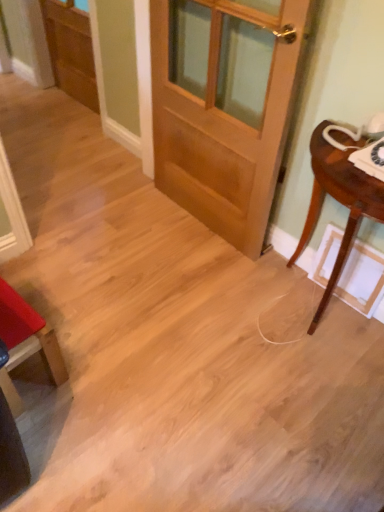
What do you see at coordinates (224, 108) in the screenshot?
I see `light brown wood door at center` at bounding box center [224, 108].

What do you see at coordinates (338, 201) in the screenshot?
I see `mahogany wood table at right` at bounding box center [338, 201].

Locate an element on the screen. light brown wood door at center is located at coordinates click(224, 108).

Locate an element on the screen. This screenshot has height=512, width=384. screen door located above the matte red chair at lower left (from a real-world perspective) is located at coordinates (71, 50).

Is matte red chair at lower left far from wooden screen door at upper left?

Yes, matte red chair at lower left and wooden screen door at upper left are located far from each other.

Which is closer to the camera, (x=22, y=307) or (x=61, y=46)?

Point (x=22, y=307) is positioned closer to the camera compared to point (x=61, y=46).

Which is correct: matte red chair at lower left is inside wooden screen door at upper left, or outside of it?

matte red chair at lower left exists outside the volume of wooden screen door at upper left.

Are mahogany wood table at right and light brown wood door at center far apart?

No, there isn't a large distance between mahogany wood table at right and light brown wood door at center.

From the image's perspective, is mahogany wood table at right located above light brown wood door at center?

No.

Is mahogany wood table at right smaller than light brown wood door at center?

Incorrect, mahogany wood table at right is not smaller in size than light brown wood door at center.

In the image, is mahogany wood table at right on the left side or the right side of light brown wood door at center?

In the image, mahogany wood table at right appears on the right side of light brown wood door at center.

Can you confirm if light brown wood door at center is positioned to the left of mahogany wood table at right?

Correct, you'll find light brown wood door at center to the left of mahogany wood table at right.

From a real-world perspective, does light brown wood door at center sit lower than mahogany wood table at right?

Actually, light brown wood door at center is physically above mahogany wood table at right in the real world.

Is light brown wood door at center wider than mahogany wood table at right?

No, light brown wood door at center is not wider than mahogany wood table at right.

Does light brown wood door at center turn towards mahogany wood table at right?

No, light brown wood door at center does not turn towards mahogany wood table at right.

Is matte red chair at lower left positioned before mahogany wood table at right?

That is False.

Which of these two, matte red chair at lower left or mahogany wood table at right, is thinner?

Thinner between the two is mahogany wood table at right.

Between point (26, 315) and point (348, 238), which one is positioned in front?

The point (26, 315) is in front.

Locate an element on the screen. The width and height of the screenshot is (384, 512). chair below the mahogany wood table at right (from a real-world perspective) is located at coordinates (26, 343).

Does point (54, 378) appear closer or farther from the camera than point (166, 73)?

Point (54, 378) is positioned closer to the camera compared to point (166, 73).

Considering the sizes of objects matte red chair at lower left and light brown wood door at center in the image provided, who is bigger, matte red chair at lower left or light brown wood door at center?

Bigger between the two is light brown wood door at center.

Identify the location of chair to the left of light brown wood door at center. (26, 343).

From their relative heights in the image, would you say light brown wood door at center is taller or shorter than matte red chair at lower left?

Clearly, light brown wood door at center is taller compared to matte red chair at lower left.

Is light brown wood door at center placed right next to matte red chair at lower left?

No, light brown wood door at center is not touching matte red chair at lower left.

From the image's perspective, does light brown wood door at center appear higher than matte red chair at lower left?

Yes.

Is point (84, 63) positioned before point (206, 42)?

No, (84, 63) is further to viewer.

From their relative heights in the image, would you say wooden screen door at upper left is taller or shorter than light brown wood door at center?

wooden screen door at upper left is shorter than light brown wood door at center.

Consider the image. Between wooden screen door at upper left and light brown wood door at center, which one has larger size?

light brown wood door at center.

What are the coordinates of `screen door that is under the light brown wood door at center (from a real-world perspective)` in the screenshot? It's located at (71, 50).

You are a GUI agent. You are given a task and a screenshot of the screen. Output one action in this format:
    pyautogui.click(x=<x>, y=<y>)
    Task: Click on the chair lying in front of the wooden screen door at upper left
    The width and height of the screenshot is (384, 512).
    Given the screenshot: What is the action you would take?
    (26, 343)

Where is `table directly beneath the light brown wood door at center (from a real-world perspective)`? The height and width of the screenshot is (512, 384). table directly beneath the light brown wood door at center (from a real-world perspective) is located at coordinates (338, 201).

Based on their spatial positions, is light brown wood door at center or mahogany wood table at right further from matte red chair at lower left?

Among the two, light brown wood door at center is located further to matte red chair at lower left.

When comparing their distances from mahogany wood table at right, does light brown wood door at center or wooden screen door at upper left seem further?

Based on the image, wooden screen door at upper left appears to be further to mahogany wood table at right.

When comparing their distances from wooden screen door at upper left, does light brown wood door at center or matte red chair at lower left seem further?

The object further to wooden screen door at upper left is matte red chair at lower left.

When comparing their distances from wooden screen door at upper left, does mahogany wood table at right or light brown wood door at center seem further?

Among the two, mahogany wood table at right is located further to wooden screen door at upper left.

Which object lies further to the anchor point light brown wood door at center, matte red chair at lower left or wooden screen door at upper left?

The object further to light brown wood door at center is wooden screen door at upper left.

In the scene shown: Based on their spatial positions, is mahogany wood table at right or matte red chair at lower left closer to light brown wood door at center?

mahogany wood table at right.

Consider the image. Considering their positions, is light brown wood door at center positioned further to mahogany wood table at right than matte red chair at lower left?

matte red chair at lower left is positioned further to the anchor mahogany wood table at right.

Estimate the real-world distances between objects in this image. Which object is closer to wooden screen door at upper left, matte red chair at lower left or mahogany wood table at right?

Based on the image, matte red chair at lower left appears to be nearer to wooden screen door at upper left.

Where is `table between wooden screen door at upper left and matte red chair at lower left in the up-down direction`? The image size is (384, 512). table between wooden screen door at upper left and matte red chair at lower left in the up-down direction is located at coordinates (338, 201).

Where is `door positioned between mahogany wood table at right and wooden screen door at upper left from near to far`? This screenshot has height=512, width=384. door positioned between mahogany wood table at right and wooden screen door at upper left from near to far is located at coordinates (224, 108).

Locate an element on the screen. The width and height of the screenshot is (384, 512). door between matte red chair at lower left and mahogany wood table at right is located at coordinates point(224,108).

I want to click on door that lies between wooden screen door at upper left and matte red chair at lower left from top to bottom, so click(x=224, y=108).